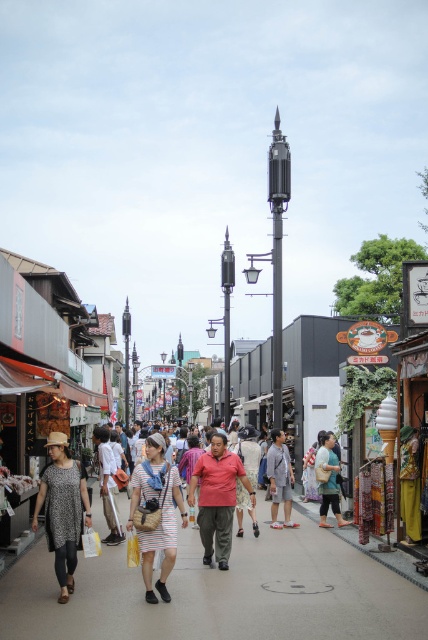
Question: Estimate the real-world distances between objects in this image. Which object is closer to the leopard print dress at center?

Choices:
 (A) green fabric bag at center
 (B) gray cotton shirt at center

Answer: (B)

Question: Is leopard print dress at center to the right of red matte shirt at center from the viewer's perspective?

Choices:
 (A) yes
 (B) no

Answer: (B)

Question: Which point is closer to the camera?

Choices:
 (A) (338, 470)
 (B) (279, 593)

Answer: (B)

Question: Which point is farther to the camera?

Choices:
 (A) (71, 499)
 (B) (171, 477)
 (C) (338, 461)

Answer: (C)

Question: Can you confirm if gray cotton shirt at center is positioned to the right of green fabric bag at center?

Choices:
 (A) no
 (B) yes

Answer: (A)

Question: Does striped fabric dress at center have a greater width compared to red matte shirt at center?

Choices:
 (A) yes
 (B) no

Answer: (B)